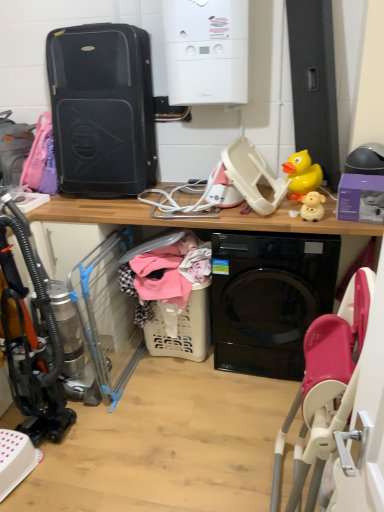
Locate an element on the screen. The height and width of the screenshot is (512, 384). vacant space that is to the left of white matte sheep at upper right, placed as the second toy when sorted from top to bottom is located at coordinates (285, 219).